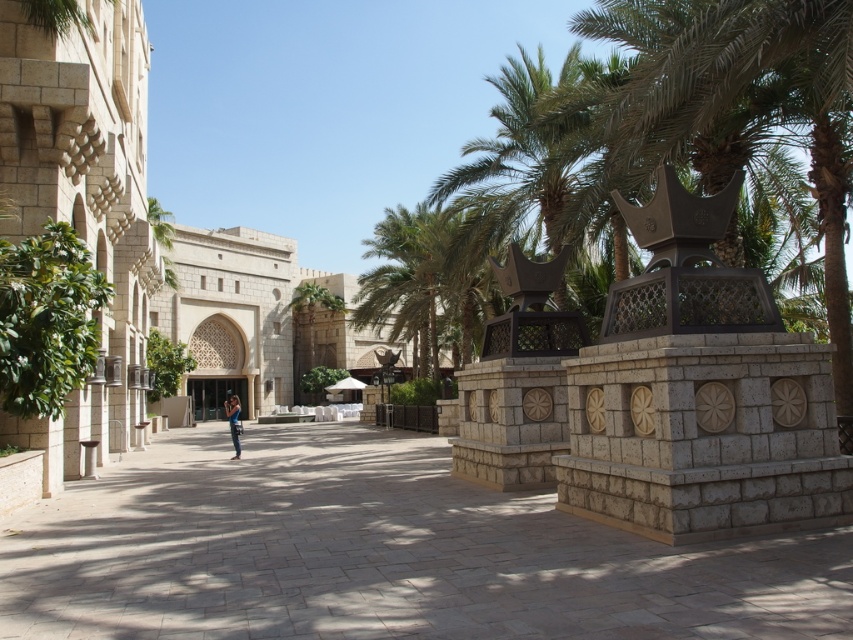
You are standing in the plaza and want to take a photo of the green leafy palm tree at center. Your camera can focus on objects up to 30 meters away. Will the palm tree be in focus?

The green leafy palm tree at center is 26.31 meters away from the camera, which is within the camera focus range of up to 30 meters. Therefore, the palm tree will be in focus.

You are standing in the plaza and want to take a photo of the blue denim jeans at center without any obstruction. Considering the height of the green leafy palm tree at center, will the palm tree block the view of the jeans in your photo?

The green leafy palm tree at center is much taller than the blue denim jeans at center, so it might block the view unless you position yourself lower or move the jeans to a spot where the tree isn